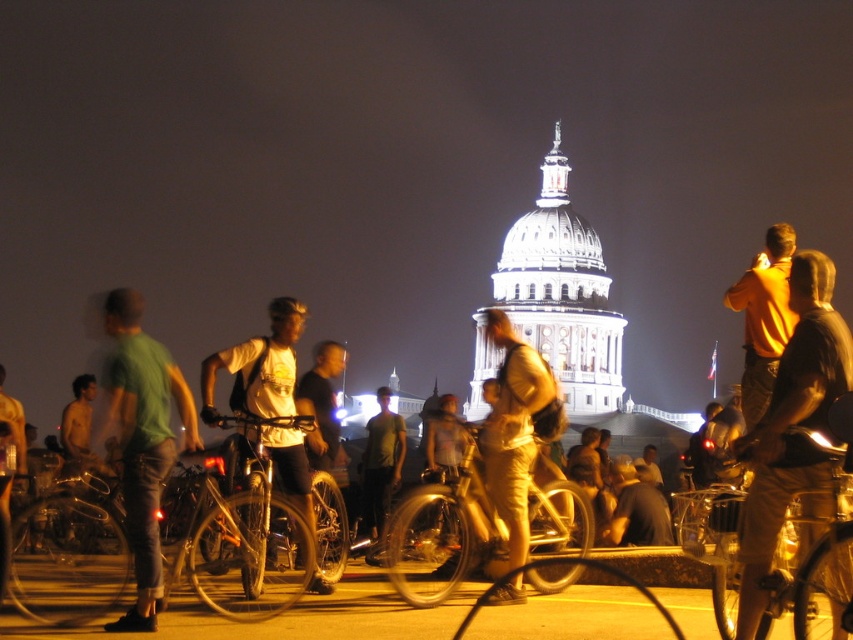
You are a photographer trying to capture both the shiny silver bicycle at center and the shiny metallic bicycle at center in a single frame. Since you want to show their height difference clearly, which bicycle should you position closer to the camera to emphasize the height difference?

To emphasize the height difference between the shiny silver bicycle at center and the shiny metallic bicycle at center, position the shorter shiny silver bicycle at center closer to the camera. This will make its apparent height more noticeable compared to the taller shiny metallic bicycle at center placed slightly farther back.

You are a photographer trying to capture a clear photo of the shiny silver bicycle at center and the shiny metallic bicycle at center. Since the scene is dark, you need to adjust your camera settings. Which bicycle might require a shorter exposure time due to its size?

The shiny silver bicycle at center has a larger size compared to the shiny metallic bicycle at center. A larger object might reflect more light, potentially allowing for a shorter exposure time to avoid overexposure. Alternatively, if motion is a factor, a larger object might be moving slower, but since both are bicycles, their speed is likely similar. However, based on size alone, the larger shiny silver bicycle at center may need a shorter exposure to capture details without washing out.

You are a photographer standing at the center of the scene. You want to take a photo that includes both the yellow shirt at right and the shiny metallic bicycle at center. What is the minimum distance you need to move to ensure both are in frame?

The yellow shirt at right and shiny metallic bicycle at center are 21.71 meters apart. To include both in the frame, you need to move back until both are within your camera lens view. The exact distance depends on your camera lens, but the objects are 21.71 meters apart from each other.